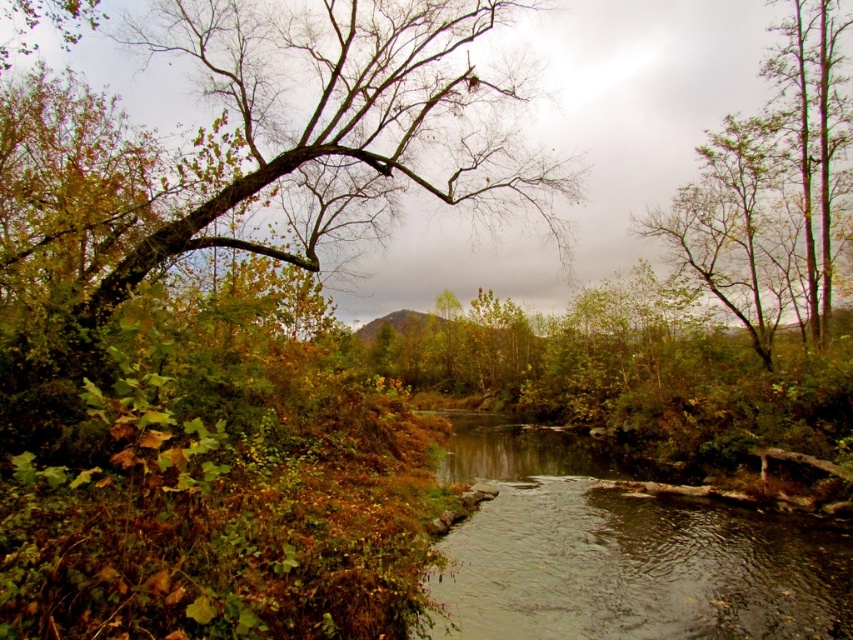
Based on the photo, can you confirm if green leafy tree at left is positioned to the left of brown liquid water at lower center?

Yes, green leafy tree at left is to the left of brown liquid water at lower center.

Does green leafy tree at left have a lesser height compared to brown liquid water at lower center?

Incorrect, green leafy tree at left's height does not fall short of brown liquid water at lower center's.

Is point (41, 195) farther from viewer compared to point (502, 529)?

Yes, it is.

Where is `green leafy tree at left`? green leafy tree at left is located at coordinates (239, 168).